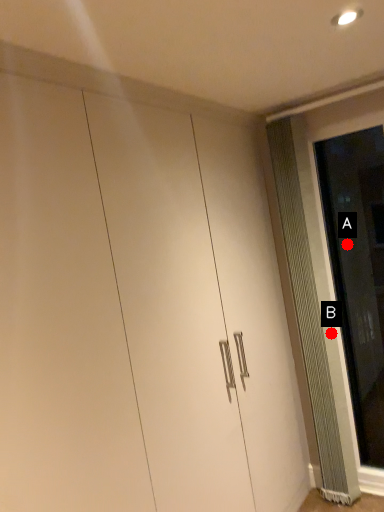
Question: Two points are circled on the image, labeled by A and B beside each circle. Which point appears farthest from the camera in this image?

Choices:
 (A) A is further
 (B) B is further

Answer: (A)